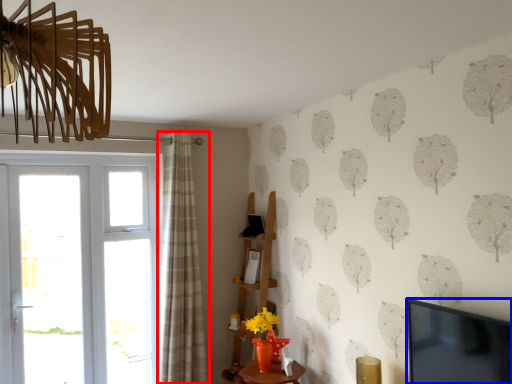
Question: Among these objects, which one is farthest to the camera, curtain (highlighted by a red box) or television (highlighted by a blue box)?

Choices:
 (A) curtain
 (B) television

Answer: (A)